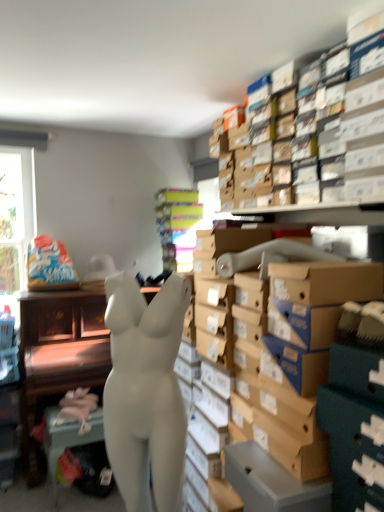
Question: Considering the positions of multicolored cardboard boxes at center and white matte mannequin at center in the image, is multicolored cardboard boxes at center bigger or smaller than white matte mannequin at center?

Choices:
 (A) big
 (B) small

Answer: (B)

Question: From their relative heights in the image, would you say multicolored cardboard boxes at center is taller or shorter than white matte mannequin at center?

Choices:
 (A) short
 (B) tall

Answer: (A)

Question: Which is nearer to the white matte mannequin at center?

Choices:
 (A) multicolored cardboard boxes at center
 (B) pink fabric at lower left
 (C) white matte mannequin at center

Answer: (B)

Question: Estimate the real-world distances between objects in this image. Which object is farther from the white matte mannequin at center?

Choices:
 (A) pink fabric at lower left
 (B) multicolored cardboard boxes at center
 (C) white matte mannequin at center

Answer: (B)